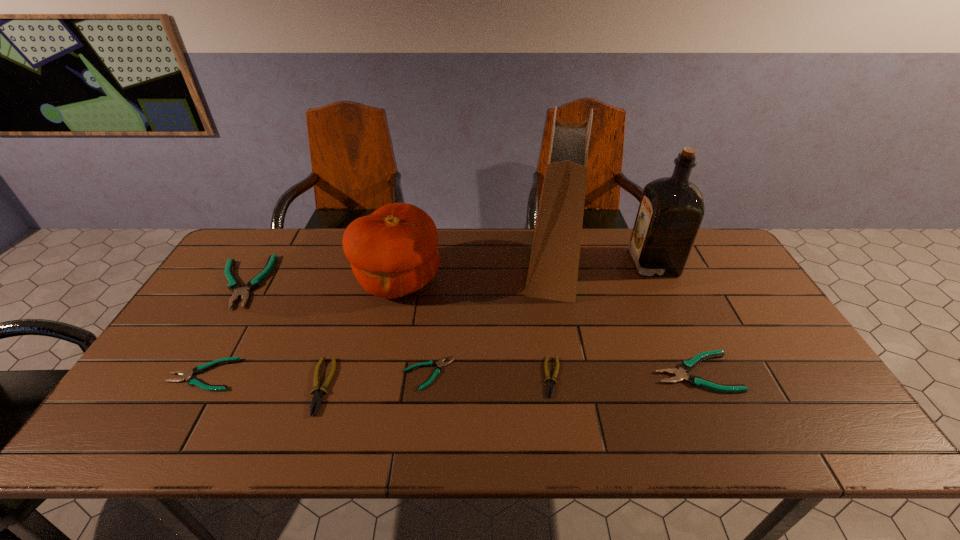
Locate an element on the screen. The width and height of the screenshot is (960, 540). the smaller yellow pliers is located at coordinates (550, 385).

Locate an element on the screen. The image size is (960, 540). the right yellow pliers is located at coordinates (550, 385).

Find the location of a particular element. the shortest pliers is located at coordinates (437, 370).

Locate an element on the screen. This screenshot has width=960, height=540. the third pliers from right to left is located at coordinates (437, 370).

This screenshot has width=960, height=540. I want to click on free space located on the front of the tallest object, so click(x=577, y=382).

Locate an element on the screen. Image resolution: width=960 pixels, height=540 pixels. vacant space located on the label of the eighth shortest object is located at coordinates (574, 262).

The width and height of the screenshot is (960, 540). I want to click on vacant space located 0.240m on the label of the eighth shortest object, so click(x=559, y=262).

At what (x,y) coordinates should I click in order to perform the action: click on free space located on the label of the eighth shortest object. Please return your answer as a coordinate pair (x, y). The image size is (960, 540). Looking at the image, I should click on (577, 262).

Locate an element on the screen. This screenshot has width=960, height=540. vacant position located 0.210m on the left of the seventh shortest object is located at coordinates (287, 280).

The height and width of the screenshot is (540, 960). What are the coordinates of `vacant point located on the right of the farthest teal pliers` in the screenshot? It's located at (292, 282).